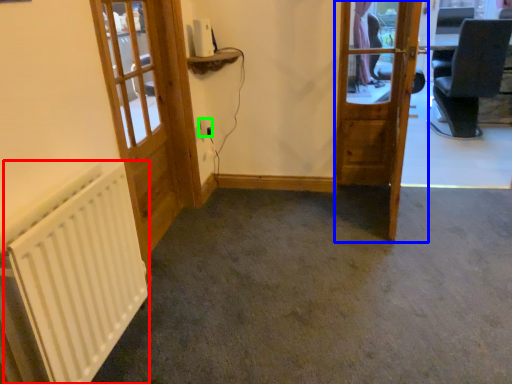
Question: Which object is positioned farthest from radiator (highlighted by a red box)? Select from door (highlighted by a blue box) and electric outlet (highlighted by a green box).

Choices:
 (A) door
 (B) electric outlet

Answer: (B)